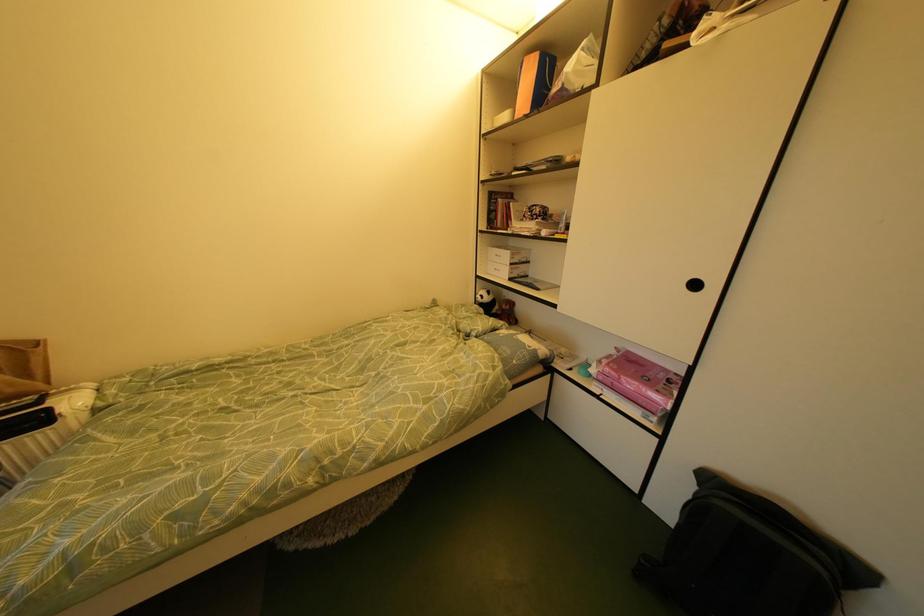
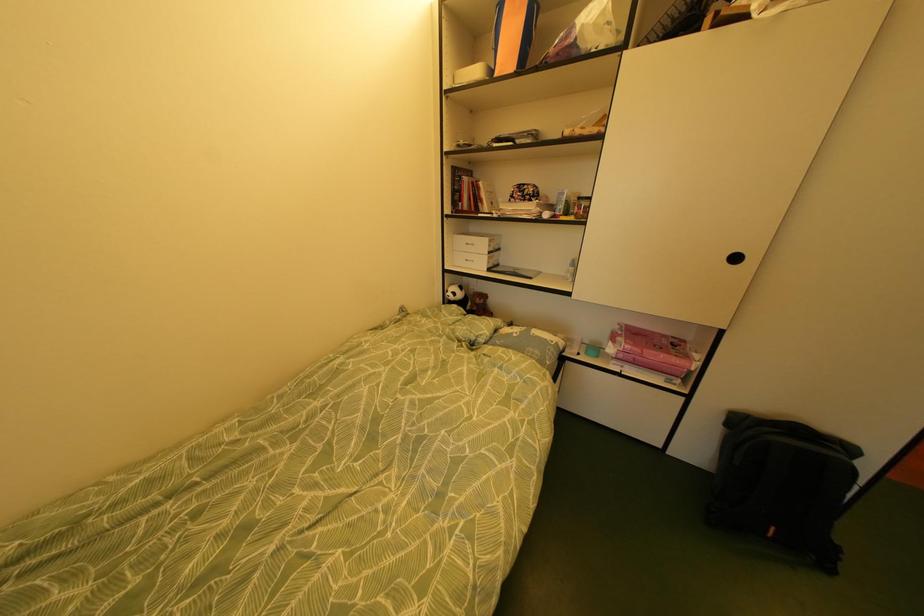
In a continuous first-person perspective shot, in which direction is the camera moving?

The cameraman moved toward left, forward.